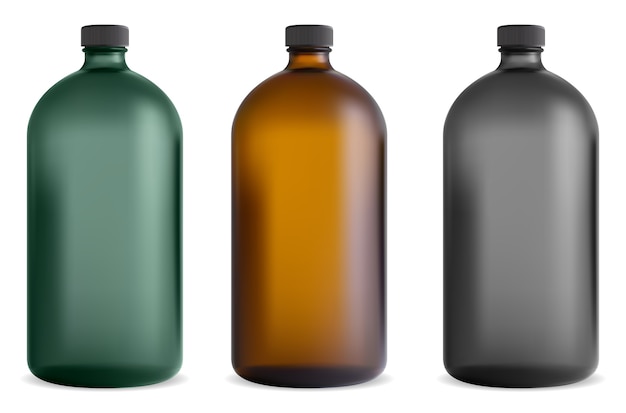
The width and height of the screenshot is (626, 413). Find the location of `bottles`. bottles is located at coordinates click(151, 260), click(335, 250), click(536, 237), click(146, 215), click(294, 216), click(515, 198).